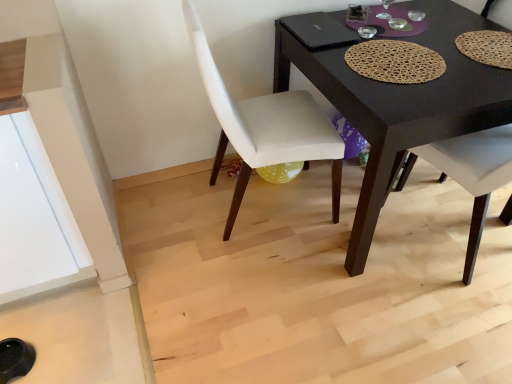
At what (x,y) coordinates should I click in order to perform the action: click on free space to the left of white fabric chair at center, arranged as the 1th chair when viewed from the left. Please return your answer as a coordinate pair (x, y). Looking at the image, I should click on (170, 216).